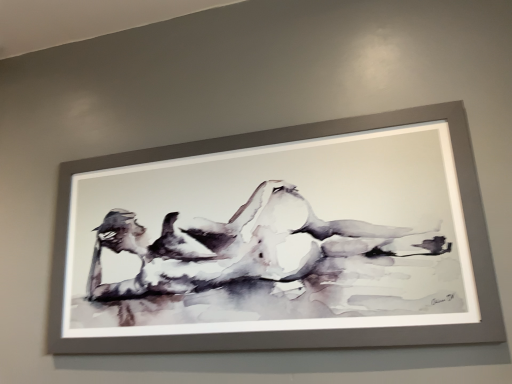
Question: Should I look upward or downward to see matte gray picture frame at center?

Choices:
 (A) down
 (B) up

Answer: (A)